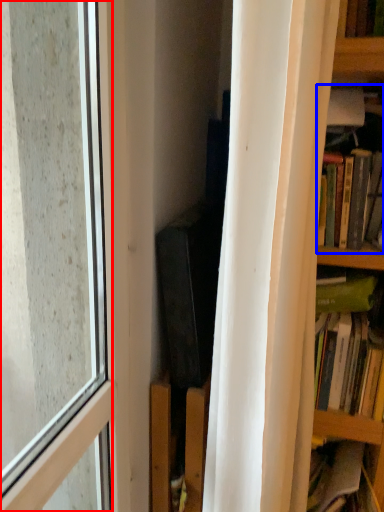
Question: Among these objects, which one is nearest to the camera, window (highlighted by a red box) or book (highlighted by a blue box)?

Choices:
 (A) window
 (B) book

Answer: (A)